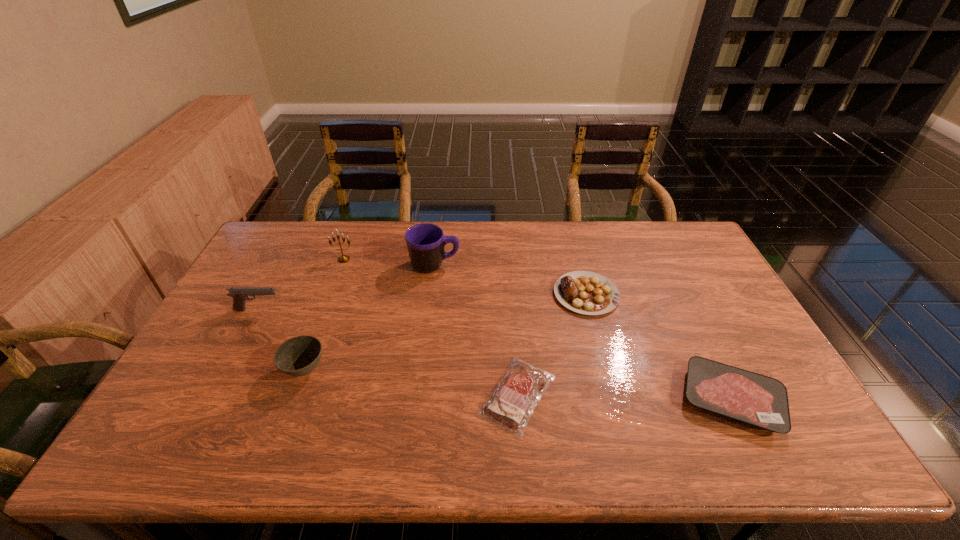
I want to click on object that is at the left edge, so click(x=239, y=294).

Where is `object located at the right edge`? The width and height of the screenshot is (960, 540). object located at the right edge is located at coordinates (761, 401).

You are a GUI agent. You are given a task and a screenshot of the screen. Output one action in this format:
    pyautogui.click(x=<x>, y=<y>)
    Task: Click on the object that is at the near right corner
    The height and width of the screenshot is (540, 960).
    Given the screenshot: What is the action you would take?
    pyautogui.click(x=761, y=401)

Identify the location of free region at the far edge. Image resolution: width=960 pixels, height=540 pixels. (367, 224).

In the image, there is a desktop. Find the location of `vacant space at the near edge`. vacant space at the near edge is located at coordinates (753, 450).

Where is `vacant area at the left edge`? vacant area at the left edge is located at coordinates (232, 370).

In the image, there is a desktop. At what (x,y) coordinates should I click in order to perform the action: click on vacant area at the right edge. Please return your answer as a coordinate pair (x, y). Looking at the image, I should click on (709, 288).

The width and height of the screenshot is (960, 540). In order to click on vacant area at the far left corner of the desktop in this screenshot , I will do (302, 224).

Find the location of a particular element. This screenshot has width=960, height=540. vacant space at the far right corner of the desktop is located at coordinates pyautogui.click(x=671, y=259).

Locate an element on the screen. free space between the bowl and the fourth object from right to left is located at coordinates (370, 318).